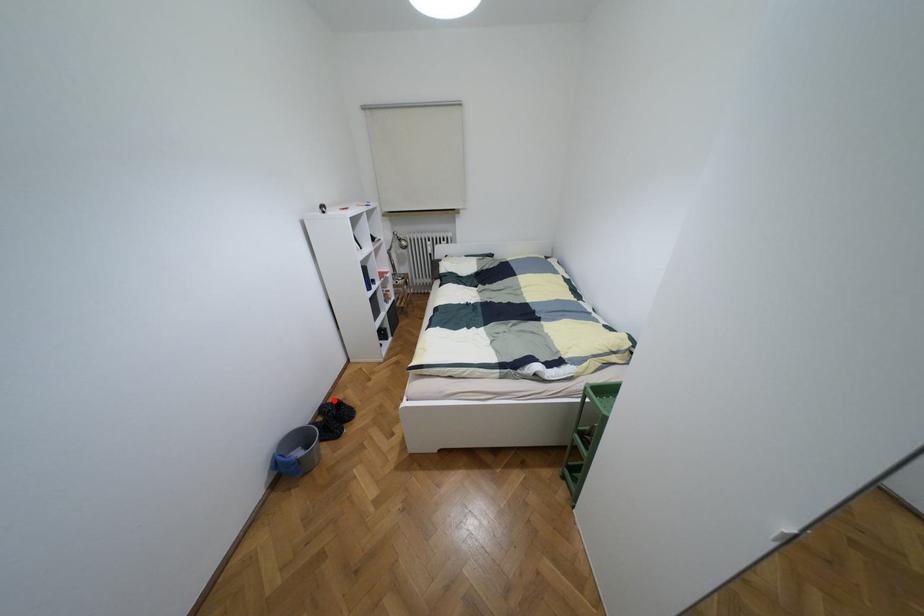
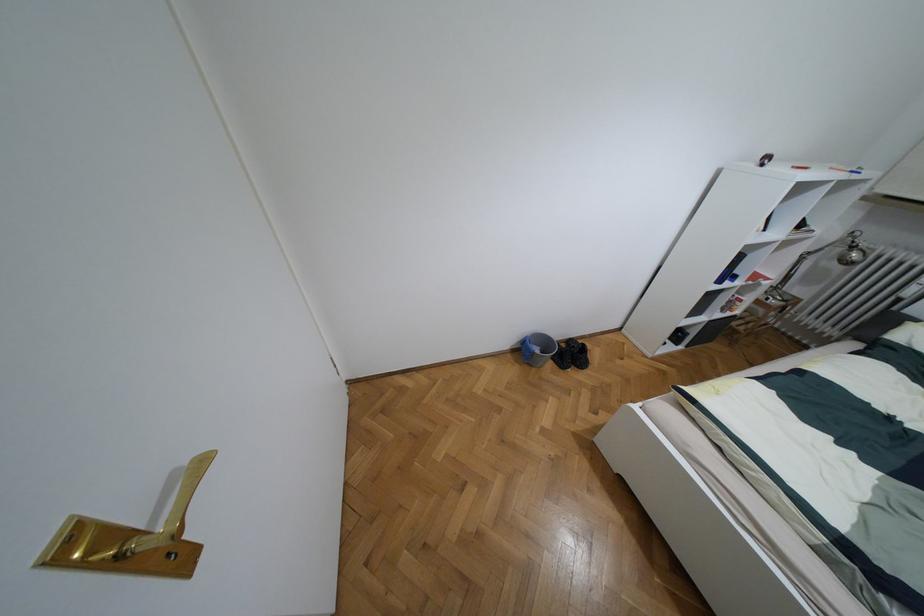
Question: I am providing you with two images of the same scene from different viewpoints. Given a red point in image1, look at the same physical point in image2. Is it:

Choices:
 (A) Closer to the viewpoint
 (B) Farther from the viewpoint

Answer: (B)